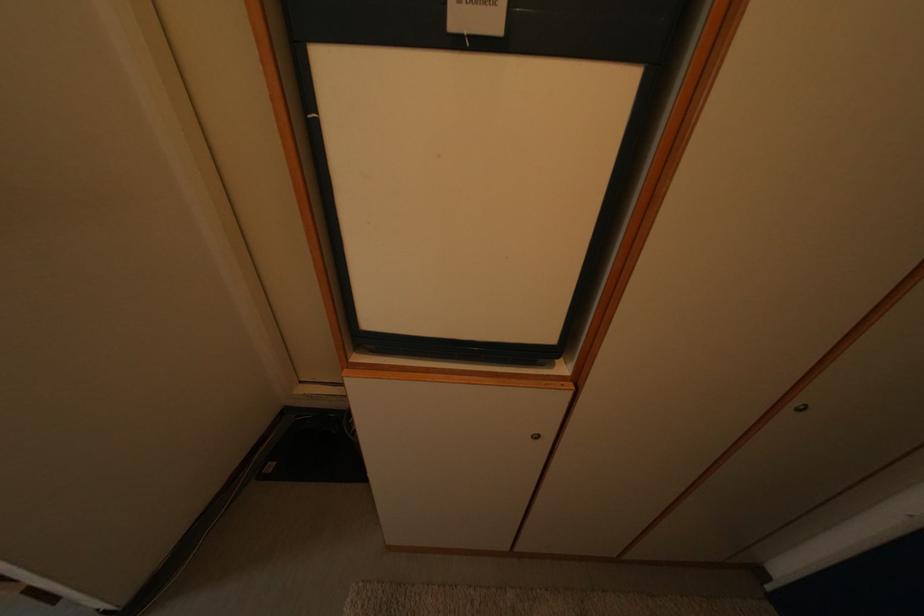
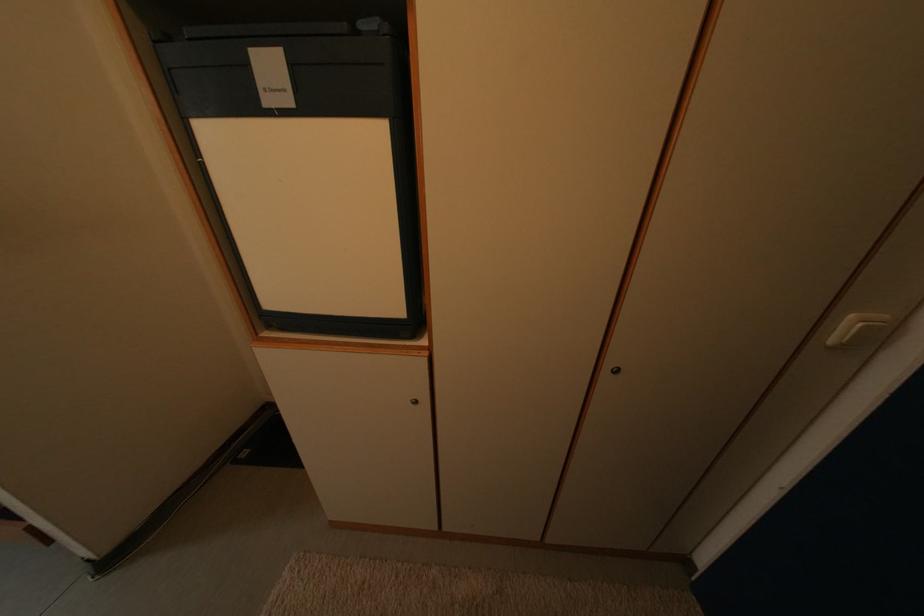
Find the pixel in the second image that matches [544,442] in the first image.

(423, 408)